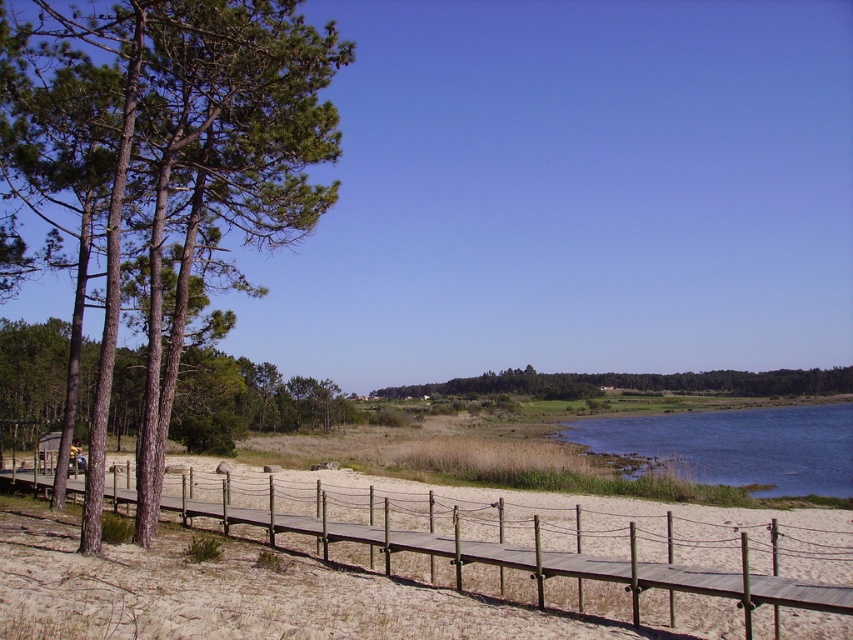
Question: Among these points, which one is nearest to the camera?

Choices:
 (A) (299, 420)
 (B) (399, 396)
 (C) (177, 264)
 (D) (831, 474)

Answer: (C)

Question: Is smooth brown tree at left in front of green leafy tree at center?

Choices:
 (A) no
 (B) yes

Answer: (B)

Question: Which object appears closest to the camera in this image?

Choices:
 (A) blue water at lower right
 (B) green leafy tree at center
 (C) smooth brown tree at left
 (D) wooden fence at lower center

Answer: (D)

Question: Does wooden fence at lower center appear under green leafy tree at center?

Choices:
 (A) yes
 (B) no

Answer: (B)

Question: Is brown rough tree at left further to the viewer compared to green leafy tree at center?

Choices:
 (A) yes
 (B) no

Answer: (B)

Question: Which of these objects is positioned closest to the brown rough tree at left?

Choices:
 (A) smooth brown tree at left
 (B) blue water at lower right

Answer: (A)